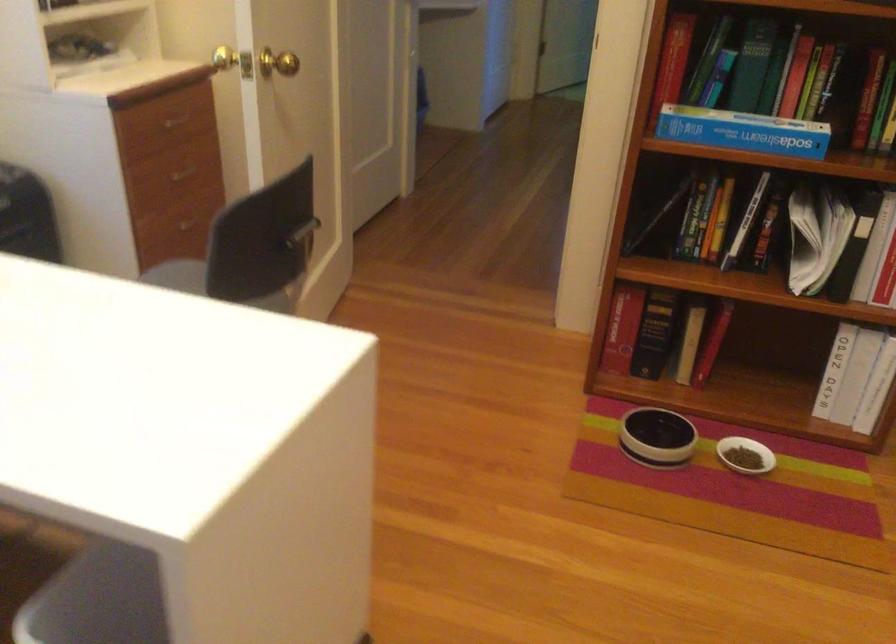
What do you see at coordinates (304, 232) in the screenshot?
I see `the chair back handle` at bounding box center [304, 232].